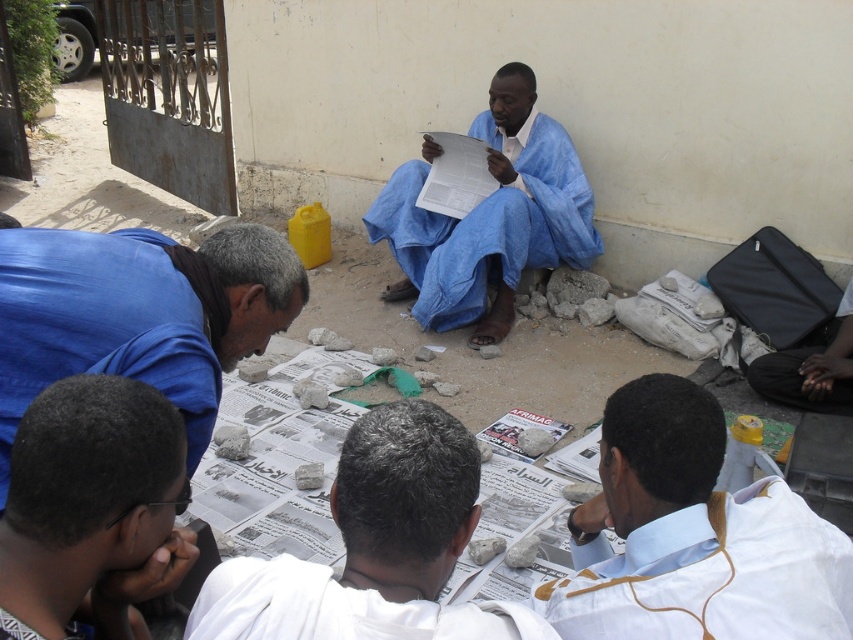
Consider the image. Can you confirm if blue fabric robe at lower left is bigger than white cotton robe at lower center?

Yes, blue fabric robe at lower left is bigger than white cotton robe at lower center.

Can you confirm if blue fabric robe at lower left is wider than white cotton robe at lower center?

In fact, blue fabric robe at lower left might be narrower than white cotton robe at lower center.

Is point (41, 355) farther from viewer compared to point (287, 612)?

Yes, it is behind point (287, 612).

The image size is (853, 640). In order to click on blue fabric robe at lower left in this screenshot , I will do `click(100, 324)`.

In the scene shown: Who is positioned more to the left, blue fabric robe at center or white cotton robe at lower center?

white cotton robe at lower center is more to the left.

Is blue fabric robe at center thinner than white cotton robe at lower center?

No, blue fabric robe at center is not thinner than white cotton robe at lower center.

Which is in front, point (424, 148) or point (271, 557)?

Point (271, 557) is more forward.

Locate an element on the screen. The image size is (853, 640). blue fabric robe at center is located at coordinates (489, 227).

Which is in front, point (128, 340) or point (490, 310)?

Positioned in front is point (128, 340).

Does blue fabric robe at lower left have a lesser width compared to blue fabric robe at center?

Yes.

Who is more distant from viewer, (202, 444) or (440, 220)?

The point (440, 220) is more distant.

Where is `blue fabric robe at lower left`? The width and height of the screenshot is (853, 640). blue fabric robe at lower left is located at coordinates (100, 324).